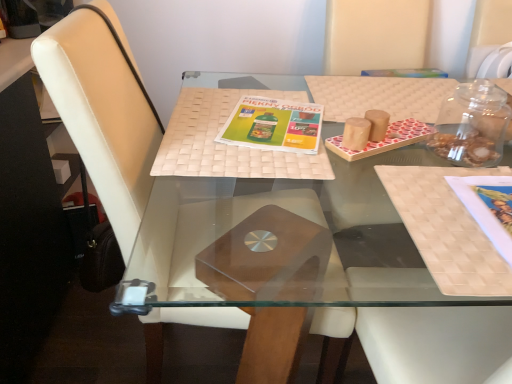
This screenshot has height=384, width=512. Find the location of `vacant area to the left of matte paper book cover at right, which is the 1th book cover in right-to-left order`. vacant area to the left of matte paper book cover at right, which is the 1th book cover in right-to-left order is located at coordinates (433, 225).